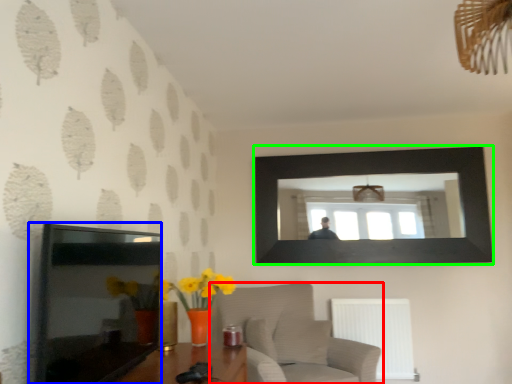
Question: Based on their relative distances, which object is farther from furniture (highlighted by a red box)? Choose from picture frame (highlighted by a blue box) and picture frame (highlighted by a green box).

Choices:
 (A) picture frame
 (B) picture frame

Answer: (A)